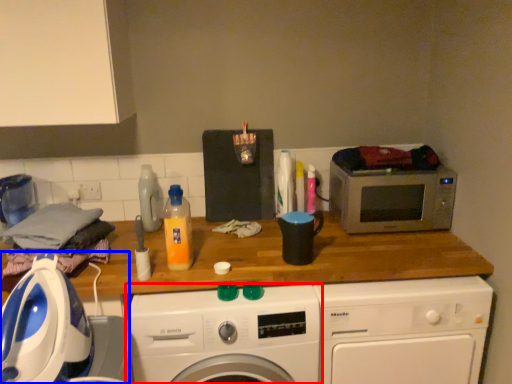
Question: Which of the following is the farthest to the observer, washing machine (highlighted by a red box) or washing machine (highlighted by a blue box)?

Choices:
 (A) washing machine
 (B) washing machine

Answer: (A)